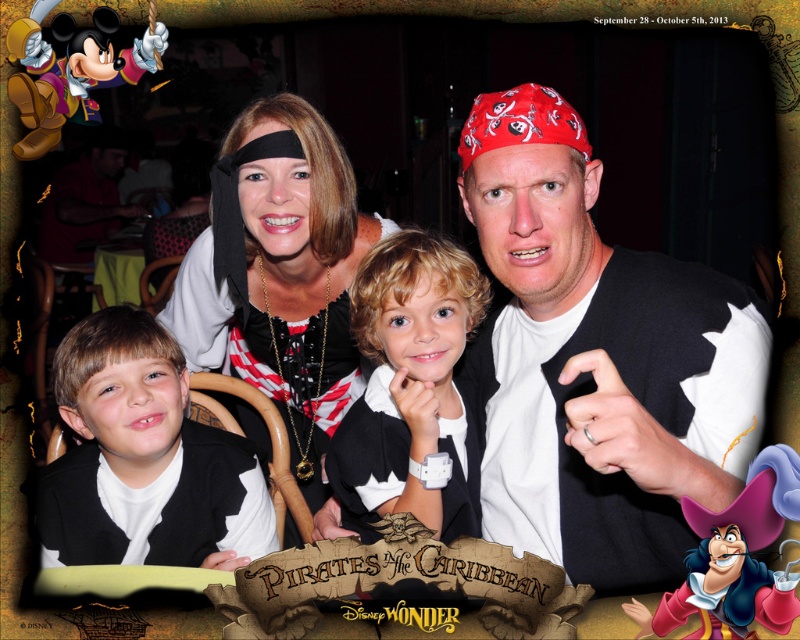
You are a photographer trying to capture a group photo of the white matte vest at center and the black matte pirate costume at center. Since you want to ensure both are fully visible, which object should you position closer to the camera to avoid being cut off?

The white matte vest at center has a lesser width compared to the black matte pirate costume at center, so you should position the white matte vest at center closer to the camera to ensure it is fully visible without being cut off.

You are a photographer at the event and need to adjust the lighting so that the white matte vest at center is fully visible without being obscured by the black matte pirate costume at center. Based on their current positions, is this possible?

The white matte vest at center is positioned under the black matte pirate costume at center, so adjusting the lighting might not fully reveal it since the black costume is above it and could cast a shadow. Consider repositioning the subjects or using additional light sources to illuminate the vest area.

You are a photographer positioned at the entrance of the venue. You need to take a photo of the white matte vest at center. Which direction should you face to ensure the vest is in the frame?

The white matte vest at center is located at point (598, 360), so you should face towards the center of the image to capture it in your frame.